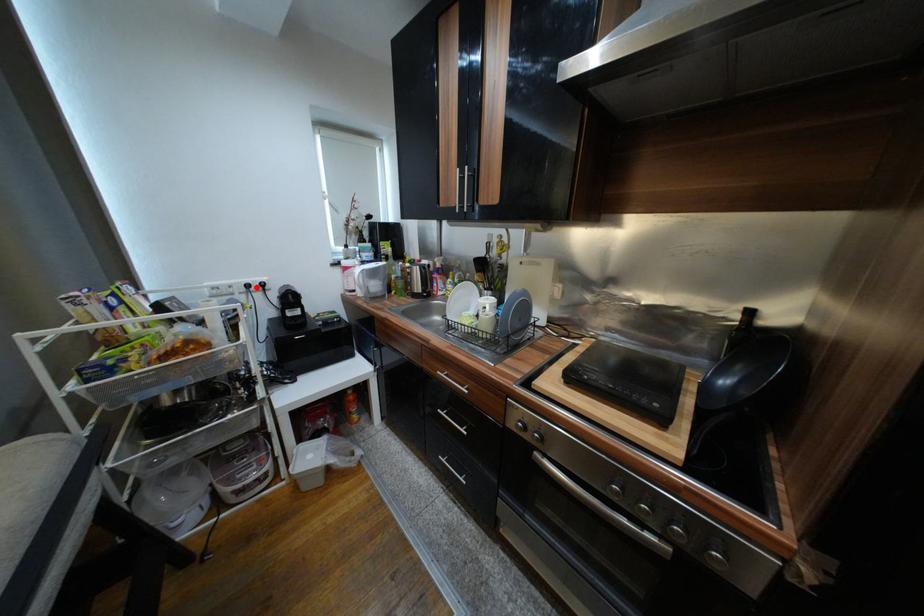
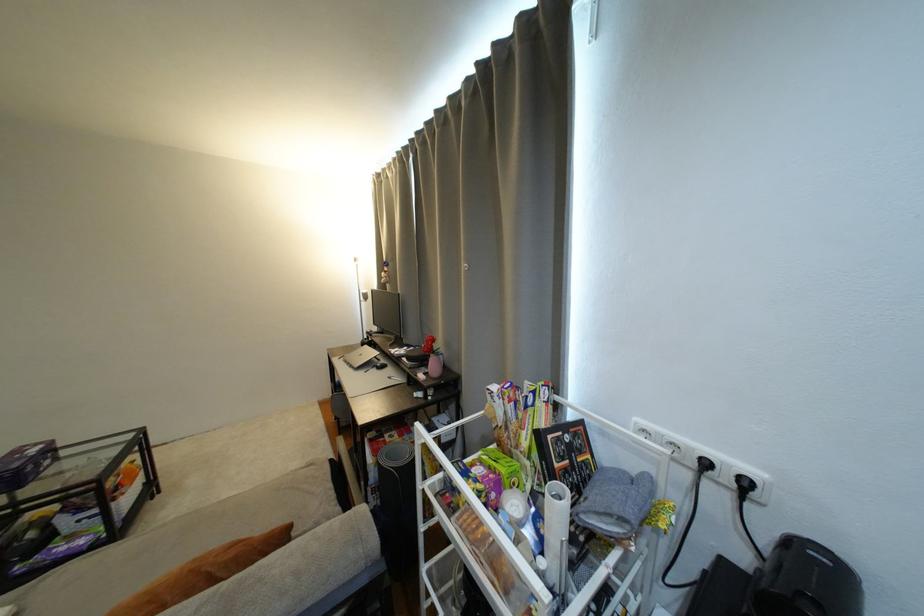
The point at the highlighted location is marked in the first image. Where is the corresponding point in the second image?

(714, 466)